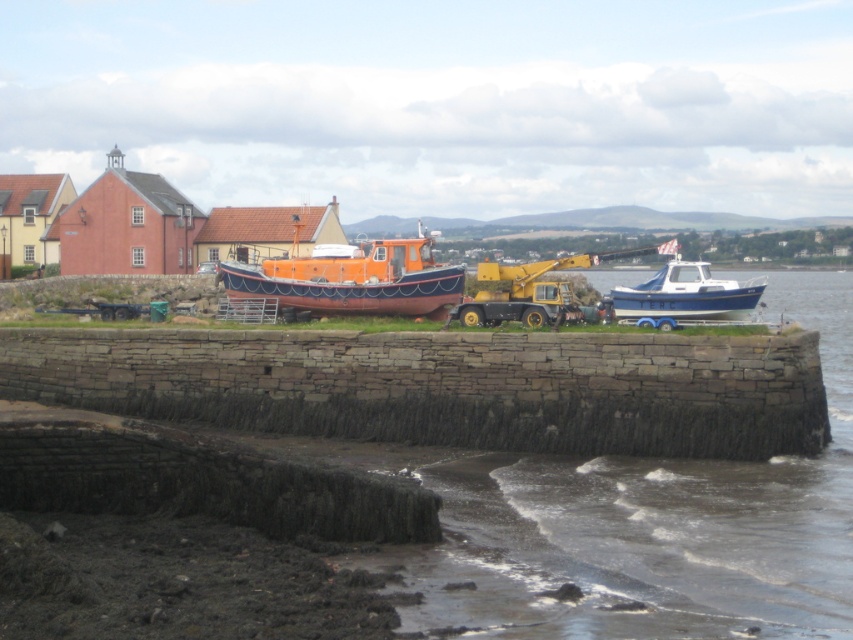
You are a dock worker who needs to transport a heavy equipment container that requires a minimum of 5 meters in length. You see the orange matte boat at center and the blue glossy boat at right. Which boat can accommodate the container based on their sizes?

The orange matte boat at center has a larger size compared to blue glossy boat at right, so it can accommodate the container requiring a minimum of 5 meters in length.

Looking at this image, you are a maintenance worker on the seawall and need to place a new buoy between the orange matte boat at center and the blue glossy boat at right. Considering their heights, which boat will the buoy be closer to?

The orange matte boat at center is much taller than the blue glossy boat at right, so the buoy will be closer to the blue glossy boat at right to avoid being obscured by the taller boat.